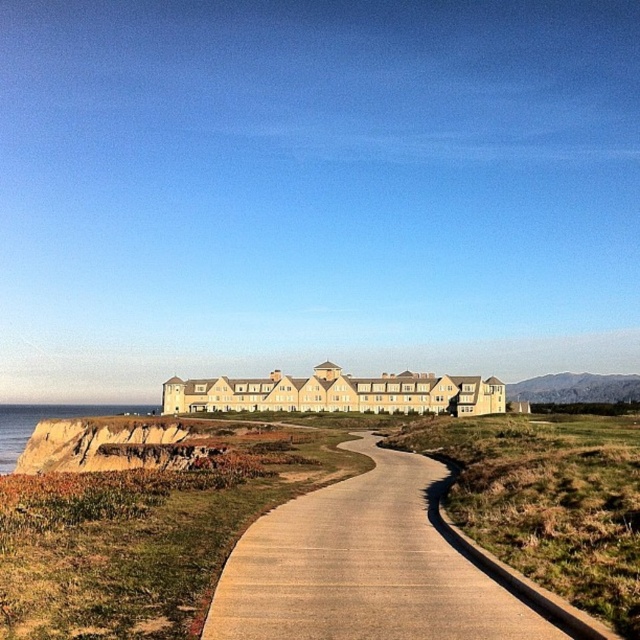
Question: Which object appears closest to the camera in this image?

Choices:
 (A) brown rocky cliff at left
 (B) concrete at center

Answer: (B)

Question: Is concrete at center to the left of brown rocky cliff at left from the viewer's perspective?

Choices:
 (A) yes
 (B) no

Answer: (B)

Question: Is concrete at center in front of brown rocky cliff at left?

Choices:
 (A) no
 (B) yes

Answer: (B)

Question: Does concrete at center lie in front of brown rocky cliff at left?

Choices:
 (A) no
 (B) yes

Answer: (B)

Question: Which of the following is the closest to the observer?

Choices:
 (A) (451, 582)
 (B) (147, 465)

Answer: (A)